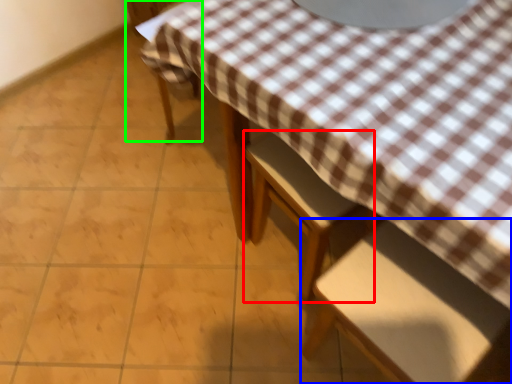
Question: Based on their relative distances, which object is nearer to chair (highlighted by a red box)? Choose from chair (highlighted by a blue box) and chair (highlighted by a green box).

Choices:
 (A) chair
 (B) chair

Answer: (A)